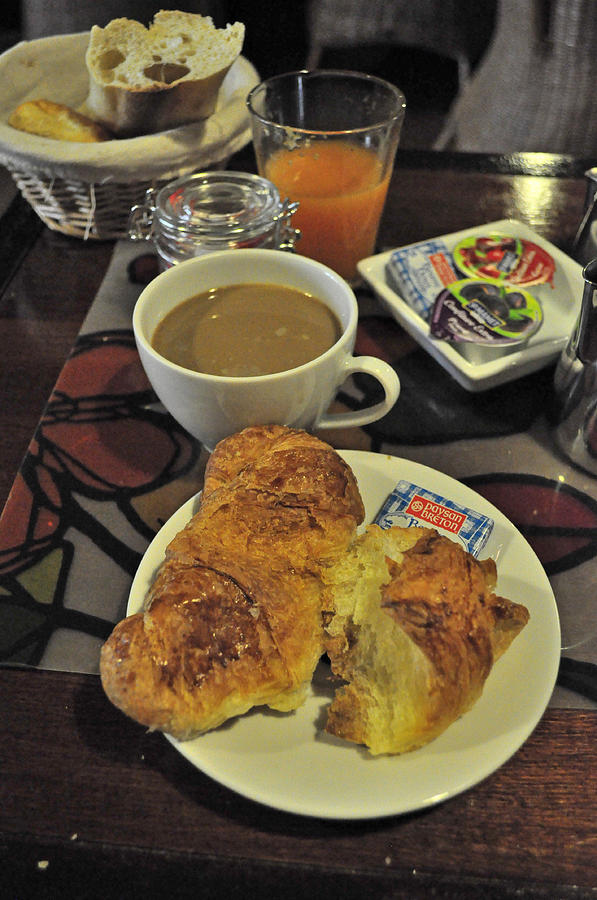
Where is `white and brown basket`? The width and height of the screenshot is (597, 900). white and brown basket is located at coordinates (104, 158).